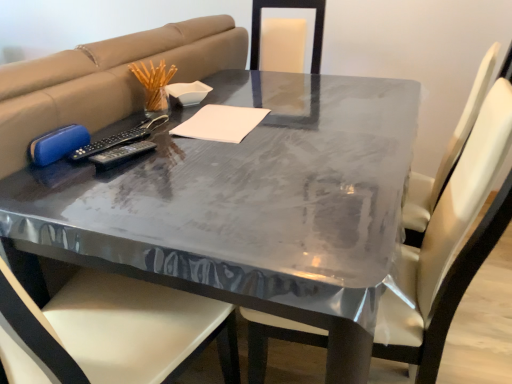
What are the coordinates of `vacant space in white paper at center (from a real-world perspective)` in the screenshot? It's located at (224, 124).